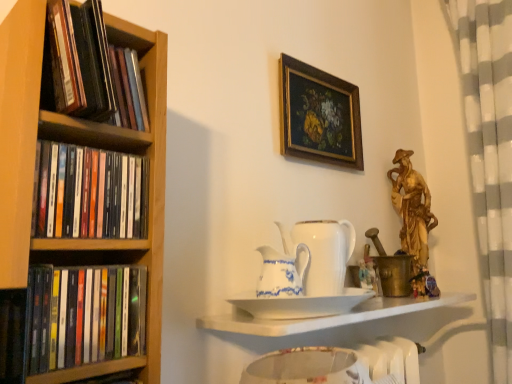
This screenshot has height=384, width=512. What do you see at coordinates (324, 316) in the screenshot?
I see `white glossy shelf at center` at bounding box center [324, 316].

At what (x,y) coordinates should I click in order to perform the action: click on brass/metallic candle holder at right. Please return your answer as a coordinate pair (x, y). Looking at the image, I should click on (392, 269).

Locate an element on the screen. The height and width of the screenshot is (384, 512). white porcelain tea pot at center, the 2th tea pot in the back-to-front sequence is located at coordinates (282, 272).

What do you see at coordinates (322, 253) in the screenshot? The image size is (512, 384). I see `white porcelain teapot at center, which appears as the 2th tea pot when viewed from the front` at bounding box center [322, 253].

At what (x,y) coordinates should I click in order to perform the action: click on gold metallic statue at upper right. Please return your answer as a coordinate pair (x, y). The width and height of the screenshot is (512, 384). Looking at the image, I should click on (412, 209).

Where is `black matte bookshelf at left, the 1th book viewed from the top`? Image resolution: width=512 pixels, height=384 pixels. black matte bookshelf at left, the 1th book viewed from the top is located at coordinates [x=92, y=68].

Where is `white glossy shelf at center`? The height and width of the screenshot is (384, 512). white glossy shelf at center is located at coordinates (324, 316).

Considering the positions of objects white porcelain tea pot at center, the 2th tea pot in the back-to-front sequence, and black matte books at left, placed as the second book when sorted from bottom to top, in the image provided, who is more to the left, white porcelain tea pot at center, the 2th tea pot in the back-to-front sequence, or black matte books at left, placed as the second book when sorted from bottom to top,?

black matte books at left, placed as the second book when sorted from bottom to top, is more to the left.

Is point (298, 246) positioned before point (73, 183)?

No, (298, 246) is further to viewer.

Could you tell me if white porcelain tea pot at center, the 2th tea pot in the back-to-front sequence, is turned towards black matte books at left, placed as the second book when sorted from bottom to top?

No, white porcelain tea pot at center, the 2th tea pot in the back-to-front sequence, is not oriented towards black matte books at left, placed as the second book when sorted from bottom to top.

Would you say black matte books at left, placed as the second book when sorted from bottom to top, is to the left or to the right of white porcelain plate at center in the picture?

Clearly, black matte books at left, placed as the second book when sorted from bottom to top, is on the left of white porcelain plate at center in the image.

Relative to white porcelain plate at center, is black matte books at left, placed as the second book when sorted from bottom to top, in front or behind?

Clearly, black matte books at left, placed as the second book when sorted from bottom to top, is in front of white porcelain plate at center.

I want to click on the 1st book in front of the white porcelain plate at center, so click(x=89, y=193).

In the scene shown: Is white porcelain plate at center positioned in front of white porcelain teapot at center, the 1th tea pot in the back-to-front sequence?

Yes, white porcelain plate at center is closer to the camera.

In the scene shown: Is white porcelain plate at center positioned beyond the bounds of white porcelain teapot at center, which appears as the 2th tea pot when viewed from the front?

Yes, white porcelain plate at center is not within white porcelain teapot at center, which appears as the 2th tea pot when viewed from the front.

Considering the sizes of objects white porcelain plate at center and white porcelain teapot at center, which appears as the 2th tea pot when viewed from the front, in the image provided, who is thinner, white porcelain plate at center or white porcelain teapot at center, which appears as the 2th tea pot when viewed from the front,?

white porcelain teapot at center, which appears as the 2th tea pot when viewed from the front, is thinner.

Is white porcelain plate at center aimed at white porcelain teapot at center, which appears as the 2th tea pot when viewed from the front?

No, white porcelain plate at center is not oriented towards white porcelain teapot at center, which appears as the 2th tea pot when viewed from the front.

Is black matte book at left, arranged as the 3th book when viewed from the top, aimed at white porcelain plate at center?

No, black matte book at left, arranged as the 3th book when viewed from the top, is not aimed at white porcelain plate at center.

Is black matte book at left, which ranks as the 1th book in bottom-to-top order, smaller than white porcelain plate at center?

Indeed, black matte book at left, which ranks as the 1th book in bottom-to-top order, has a smaller size compared to white porcelain plate at center.

Do you think black matte book at left, which ranks as the 1th book in bottom-to-top order, is within white porcelain plate at center, or outside of it?

black matte book at left, which ranks as the 1th book in bottom-to-top order, cannot be found inside white porcelain plate at center.

Is black matte book at left, which ranks as the 1th book in bottom-to-top order, wider or thinner than white porcelain plate at center?

In the image, black matte book at left, which ranks as the 1th book in bottom-to-top order, appears to be more narrow than white porcelain plate at center.

Is brass/metallic candle holder at right far from black matte book at left, which ranks as the 1th book in bottom-to-top order?

No, brass/metallic candle holder at right is in close proximity to black matte book at left, which ranks as the 1th book in bottom-to-top order.

Which is behind, brass/metallic candle holder at right or black matte book at left, arranged as the 3th book when viewed from the top?

brass/metallic candle holder at right is more distant.

Is brass/metallic candle holder at right aimed at black matte book at left, arranged as the 3th book when viewed from the top?

No, brass/metallic candle holder at right does not turn towards black matte book at left, arranged as the 3th book when viewed from the top.

Does white porcelain teapot at center, the 1th tea pot in the back-to-front sequence, have a greater height compared to brass/metallic candle holder at right?

Incorrect, the height of white porcelain teapot at center, the 1th tea pot in the back-to-front sequence, is not larger of that of brass/metallic candle holder at right.

Who is smaller, white porcelain teapot at center, the 1th tea pot in the back-to-front sequence, or brass/metallic candle holder at right?

white porcelain teapot at center, the 1th tea pot in the back-to-front sequence.

Is white porcelain teapot at center, the 1th tea pot in the back-to-front sequence, facing towards brass/metallic candle holder at right?

No, white porcelain teapot at center, the 1th tea pot in the back-to-front sequence, is not oriented towards brass/metallic candle holder at right.

Is white porcelain teapot at center, the 1th tea pot in the back-to-front sequence, in front of or behind brass/metallic candle holder at right in the image?

Clearly, white porcelain teapot at center, the 1th tea pot in the back-to-front sequence, is in front of brass/metallic candle holder at right.

From a real-world perspective, between gold-framed painting at upper center and white porcelain tea pot at center, which is the first tea pot in front-to-back order, who is vertically lower?

white porcelain tea pot at center, which is the first tea pot in front-to-back order.

Considering the sizes of objects gold-framed painting at upper center and white porcelain tea pot at center, the 2th tea pot in the back-to-front sequence, in the image provided, who is taller, gold-framed painting at upper center or white porcelain tea pot at center, the 2th tea pot in the back-to-front sequence,?

gold-framed painting at upper center.

Is gold-framed painting at upper center facing towards white porcelain tea pot at center, the 2th tea pot in the back-to-front sequence?

No.

Is gold-framed painting at upper center inside the boundaries of white porcelain tea pot at center, the 2th tea pot in the back-to-front sequence, or outside?

gold-framed painting at upper center cannot be found inside white porcelain tea pot at center, the 2th tea pot in the back-to-front sequence.

From a real-world perspective, starting from the white porcelain tea pot at center, which is the first tea pot in front-to-back order, which book is the 1st one vertically above it? Please provide its 2D coordinates.

[(89, 193)]

From the image's perspective, which book is the 2nd one above the white porcelain plate at center? Please provide its 2D coordinates.

[(89, 193)]

Based on the photo, considering their positions, is gold-framed painting at upper center positioned closer to gold metallic statue at upper right than white porcelain tea pot at center, the 2th tea pot in the back-to-front sequence?

Based on the image, gold-framed painting at upper center appears to be nearer to gold metallic statue at upper right.

Based on their spatial positions, is black matte books at left, placed as the second book when sorted from bottom to top, or white glossy shelf at center further from white porcelain plate at center?

black matte books at left, placed as the second book when sorted from bottom to top, is positioned further to the anchor white porcelain plate at center.

Considering their positions, is black matte bookshelf at left, the 3th book when ordered from bottom to top, positioned further to black matte books at left, placed as the second book when sorted from bottom to top, than white glossy shelf at center?

white glossy shelf at center lies further to black matte books at left, placed as the second book when sorted from bottom to top, than the other object.

Looking at the image, which one is located further to black matte bookshelf at left, the 3th book when ordered from bottom to top, white glossy shelf at center or white porcelain tea pot at center, which is the first tea pot in front-to-back order?

white glossy shelf at center is further to black matte bookshelf at left, the 3th book when ordered from bottom to top.

Considering their positions, is white porcelain teapot at center, the 1th tea pot in the back-to-front sequence, positioned closer to gold metallic statue at upper right than white porcelain tea pot at center, which is the first tea pot in front-to-back order?

white porcelain teapot at center, the 1th tea pot in the back-to-front sequence, is closer to gold metallic statue at upper right.

When comparing their distances from gold metallic statue at upper right, does black matte book at left, arranged as the 3th book when viewed from the top, or white porcelain tea pot at center, the 2th tea pot in the back-to-front sequence, seem closer?

The object closer to gold metallic statue at upper right is white porcelain tea pot at center, the 2th tea pot in the back-to-front sequence.

Considering their positions, is black matte books at left, placed as the second book when sorted from bottom to top, positioned closer to gold metallic statue at upper right than black matte book at left, arranged as the 3th book when viewed from the top?

The object closer to gold metallic statue at upper right is black matte books at left, placed as the second book when sorted from bottom to top.

Considering their positions, is black matte book at left, arranged as the 3th book when viewed from the top, positioned closer to brass/metallic candle holder at right than white porcelain plate at center?

white porcelain plate at center is closer to brass/metallic candle holder at right.

Locate an element on the screen. candle holder between black matte book at left, arranged as the 3th book when viewed from the top, and gold metallic statue at upper right, along the z-axis is located at coordinates (392, 269).

This screenshot has height=384, width=512. I want to click on plate between black matte bookshelf at left, the 1th book viewed from the top, and gold-framed painting at upper center from front to back, so click(300, 304).

Image resolution: width=512 pixels, height=384 pixels. Identify the location of shelf located between black matte book at left, which ranks as the 1th book in bottom-to-top order, and brass/metallic candle holder at right in the left-right direction. (324, 316).

Find the location of a particular element. This screenshot has width=512, height=384. picture frame positioned between black matte book at left, arranged as the 3th book when viewed from the top, and brass/metallic candle holder at right from near to far is located at coordinates (319, 115).